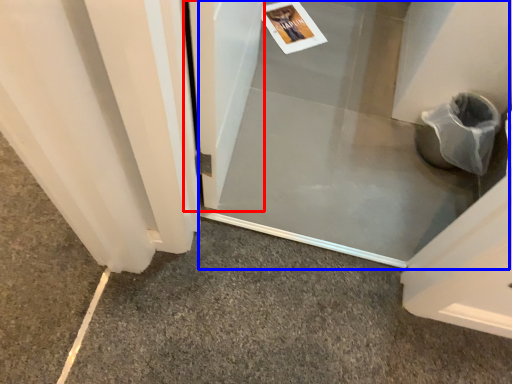
Question: Among these objects, which one is nearest to the camera, screen door (highlighted by a red box) or screen door (highlighted by a blue box)?

Choices:
 (A) screen door
 (B) screen door

Answer: (A)